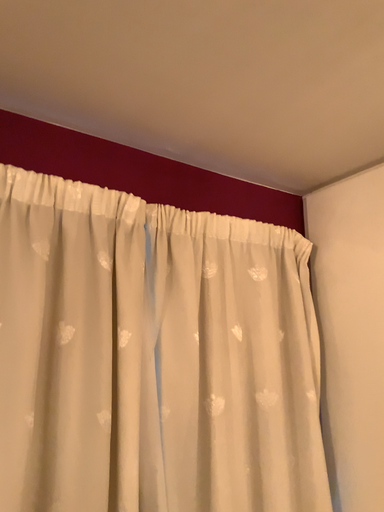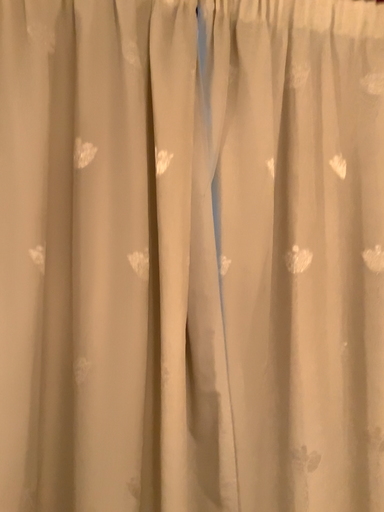
Question: Which way did the camera rotate in the video?

Choices:
 (A) rotated downward
 (B) rotated upward

Answer: (A)